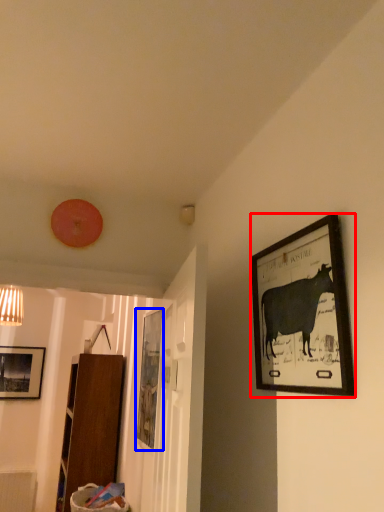
Question: Which of the following is the closest to the observer, picture frame (highlighted by a red box) or picture frame (highlighted by a blue box)?

Choices:
 (A) picture frame
 (B) picture frame

Answer: (A)